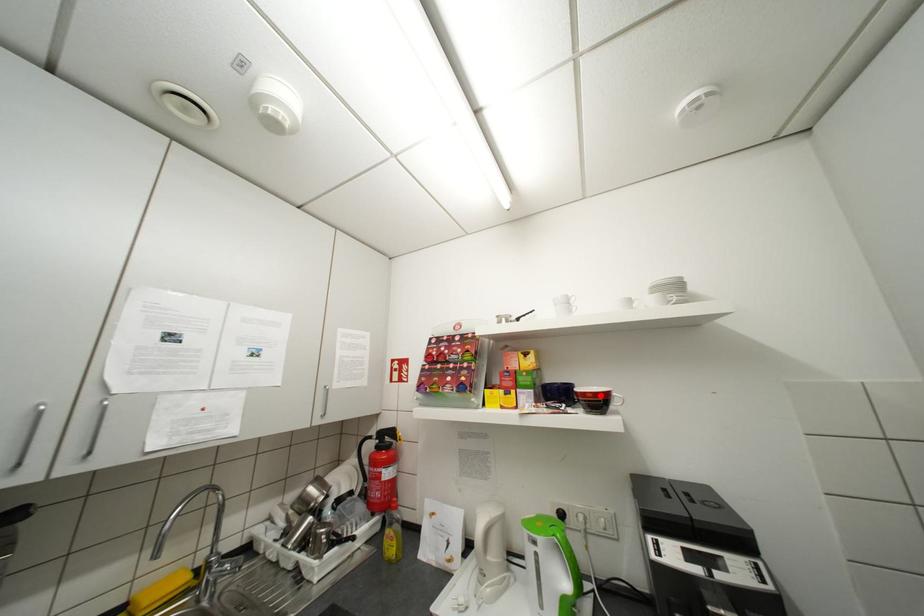
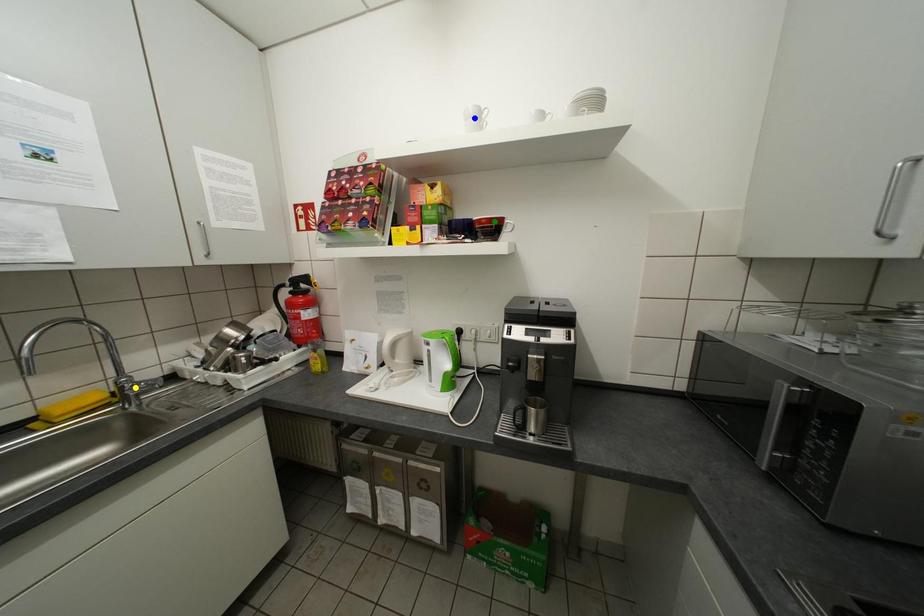
Question: I am providing you with two images of the same scene from different viewpoints. A red point is marked on the first image. You are given multiple points on the second image. Which point in image 2 represents the same 3d spot as the red point in image 1?

Choices:
 (A) green point
 (B) blue point
 (C) yellow point

Answer: (A)